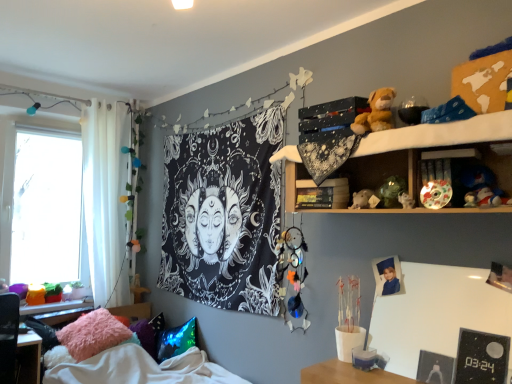
The height and width of the screenshot is (384, 512). I want to click on free space above black fabric tapestry at center (from a real-world perspective), so click(x=205, y=121).